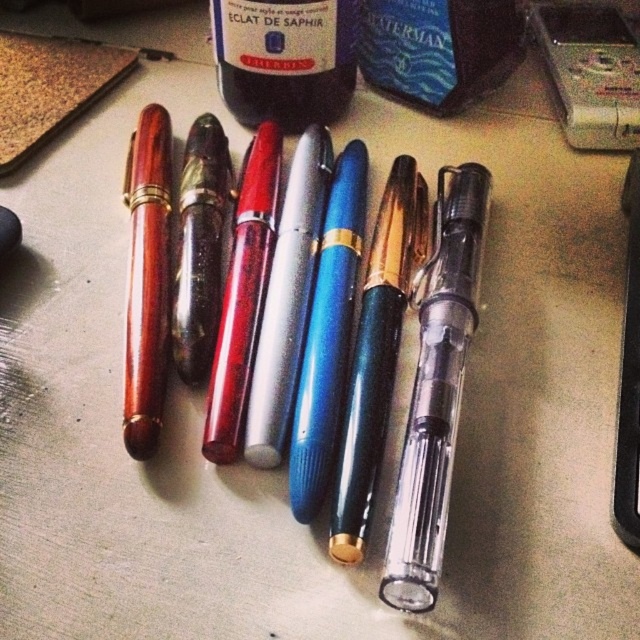
Can you confirm if translucent glass bottle at center is positioned above wooden pen at left?

Yes.

Does translucent glass bottle at center appear on the left side of wooden pen at left?

Incorrect, translucent glass bottle at center is not on the left side of wooden pen at left.

Between point (291, 67) and point (134, 314), which one is positioned in front?

Point (134, 314) is in front.

Find the location of a particular element. The height and width of the screenshot is (640, 640). translucent glass bottle at center is located at coordinates (284, 58).